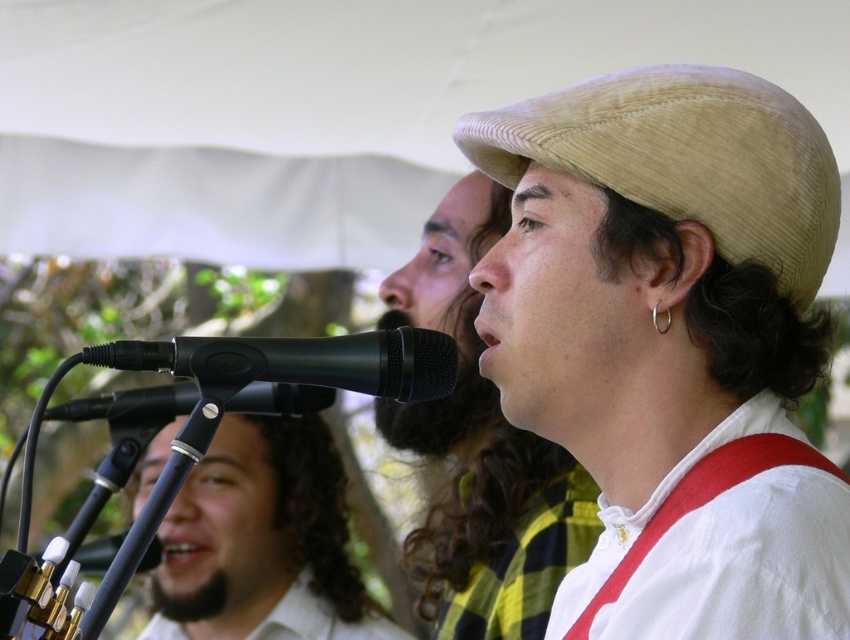
You are standing at the point marked as point [578,477] in the image. You want to move to the nearest exit, which is 10 feet away from your current position. Can you safely walk straight ahead without encountering any obstacles within the next 7.81 feet?

The distance between point [578,477] and the viewer is 7.81 feet. Since the nearest exit is 10 feet away, walking straight ahead for 7.81 feet would leave 2.19 feet remaining to the exit. However, the question specifies avoiding obstacles within the next 7.81 feet. The scene description mentions a microphone stand in the foreground and two performers in the midground. The point [578,477] is likely near the performers, so obstacles like the microphone stand or performers might be present in that path.

You are at the point marked by the coordinates (479, 451) in the image. What object is exactly at this location?

The matte straw hat at center is located at point (479, 451).

You are a stagehand setting up for a musical performance. You need to place a matte straw hat on a stand so that it is centered between the microphone stand and the performer on the right. The microphone stand is at position 0.706 on the x and 0.565 on the y. Where should you place the matte straw hat at center?

The matte straw hat at center should be placed at the midpoint between the microphone stand and the performer on the right. Since the microphone stand is at coordinates (479, 451), the hat should be positioned at the average of these coordinates and the performer on the right. However, without the exact coordinates of the performer on the right, an accurate placement cannot be determined.